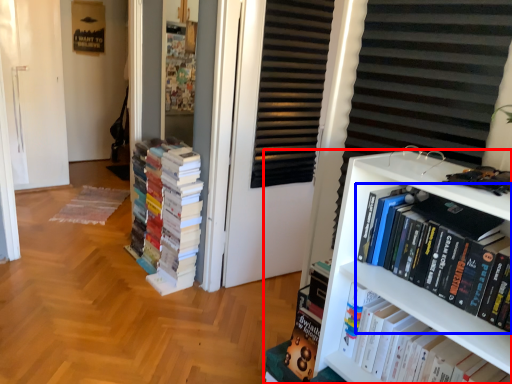
Question: Among these objects, which one is farthest to the camera, bookcase (highlighted by a red box) or book (highlighted by a blue box)?

Choices:
 (A) bookcase
 (B) book

Answer: (A)